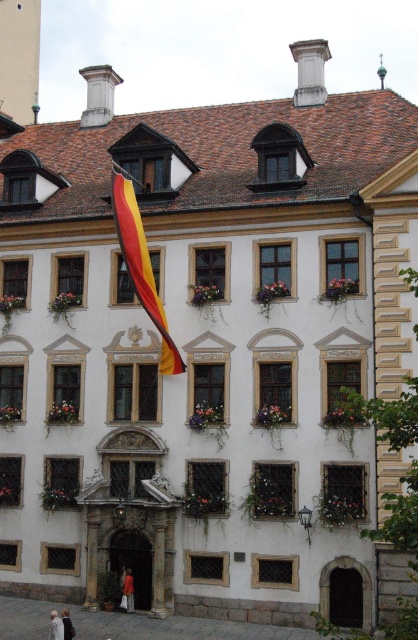
In the scene shown: Does yellow-red striped fabric at center appear under red fabric flag at upper left?

Actually, yellow-red striped fabric at center is above red fabric flag at upper left.

Does yellow-red striped fabric at center have a greater width compared to red fabric flag at upper left?

Indeed, yellow-red striped fabric at center has a greater width compared to red fabric flag at upper left.

Who is more forward, (122, 173) or (124, 582)?

Point (124, 582) is more forward.

Identify the location of yellow-red striped fabric at center. Image resolution: width=418 pixels, height=640 pixels. (140, 264).

Between yellow-red striped fabric at center and light beige coat at lower left, which one has more height?

With more height is yellow-red striped fabric at center.

Is yellow-red striped fabric at center shorter than light beige coat at lower left?

Incorrect, yellow-red striped fabric at center's height does not fall short of light beige coat at lower left's.

I want to click on yellow-red striped fabric at center, so click(140, 264).

Is red fabric flag at upper left below light beige coat at lower left?

No.

Is red fabric flag at upper left smaller than light beige coat at lower left?

Yes.

Who is more distant from viewer, (127, 573) or (51, 620)?

Point (127, 573)

The width and height of the screenshot is (418, 640). Identify the location of red fabric flag at upper left. (129, 589).